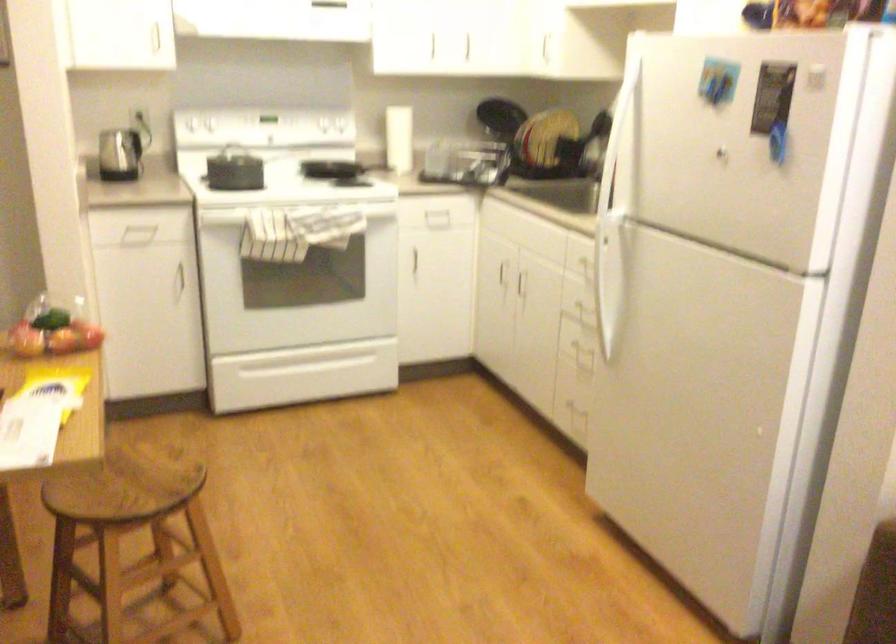
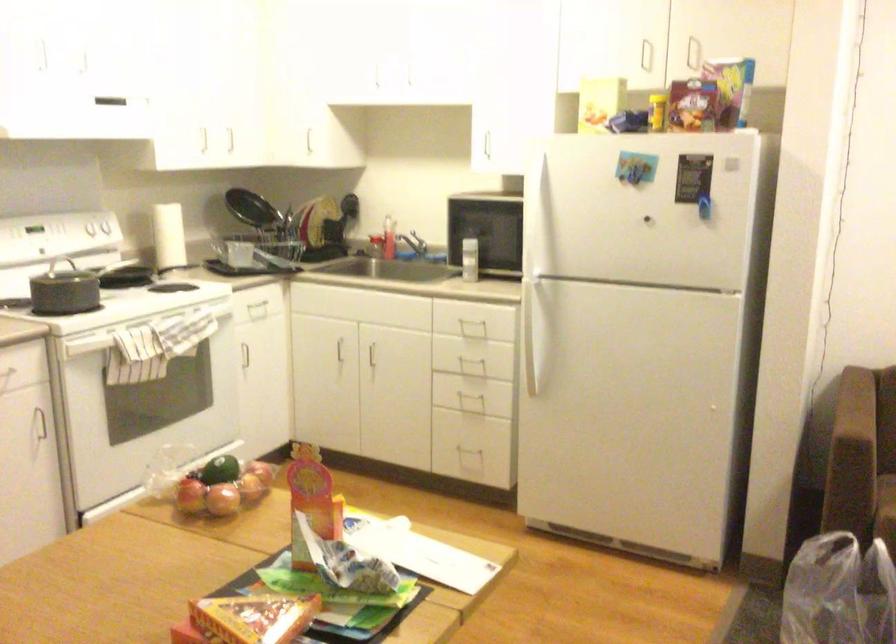
The point at (610, 281) is marked in the first image. Where is the corresponding point in the second image?

(536, 328)